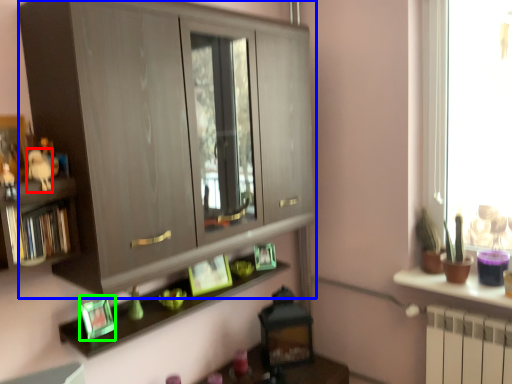
Question: Which object is positioned farthest from animal (highlighted by a red box)? Select from cabinetry (highlighted by a blue box) and picture frame (highlighted by a green box).

Choices:
 (A) cabinetry
 (B) picture frame

Answer: (A)